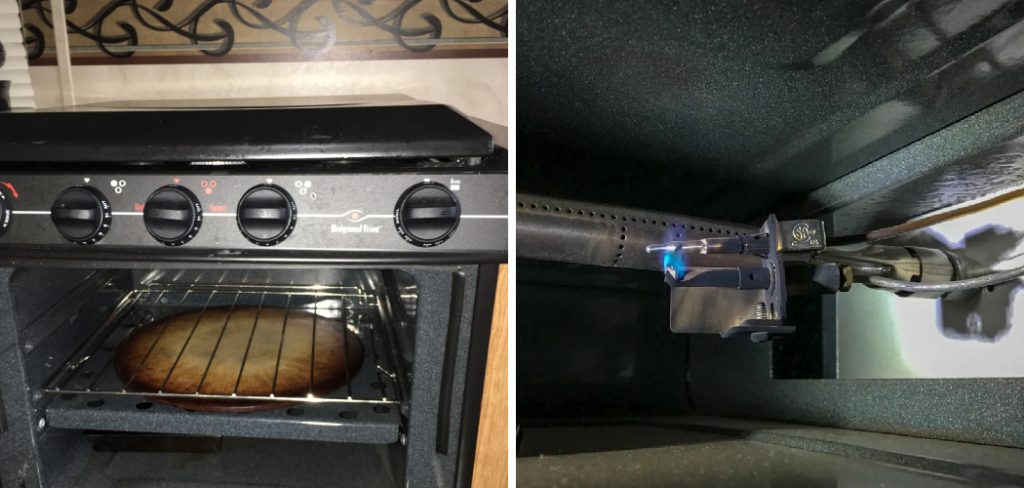
Identify the location of gray ceiling. The width and height of the screenshot is (1024, 488). (714, 79).